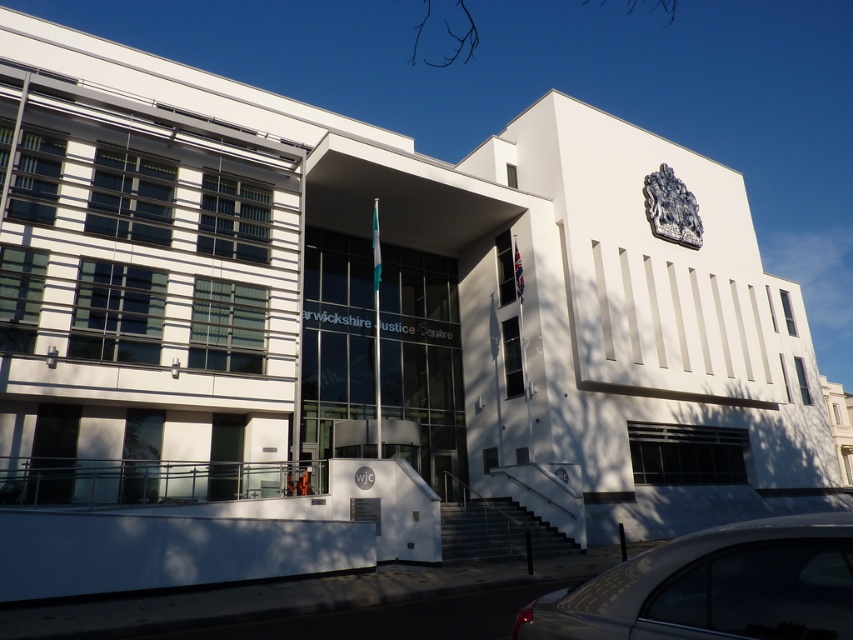
Who is more distant from viewer, (712, 541) or (693, 218)?

The point (693, 218) is more distant.

Does point (712, 529) come farther from viewer compared to point (670, 236)?

No, it is not.

Locate an element on the screen. silver metallic car at lower right is located at coordinates (714, 588).